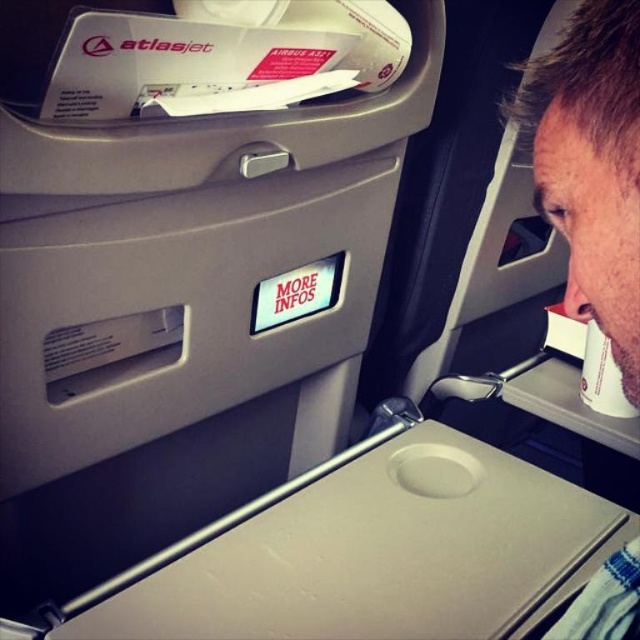
Consider the image. Between beige fabric headrest at upper right and white paper cup at right, which one appears on the right side from the viewer's perspective?

Positioned to the right is white paper cup at right.

Based on the photo, measure the distance between beige fabric headrest at upper right and camera.

beige fabric headrest at upper right and camera are 10.61 inches apart from each other.

Is point (554, 147) behind point (618, 394)?

That is False.

This screenshot has height=640, width=640. I want to click on beige fabric headrest at upper right, so click(593, 166).